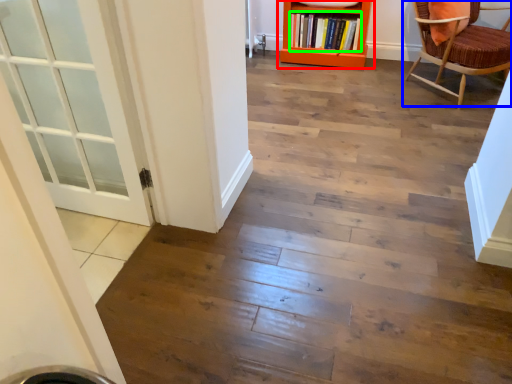
Question: Based on their relative distances, which object is nearer to bookcase (highlighted by a red box)? Choose from chair (highlighted by a blue box) and book (highlighted by a green box).

Choices:
 (A) chair
 (B) book

Answer: (B)